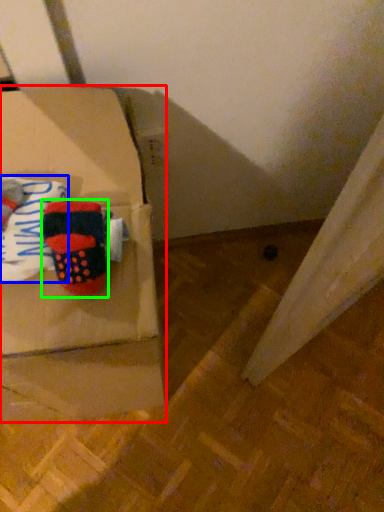
Question: Considering the real-world distances, which object is closest to box (highlighted by a red box)? clothing (highlighted by a blue box) or footwear (highlighted by a green box).

Choices:
 (A) clothing
 (B) footwear

Answer: (B)